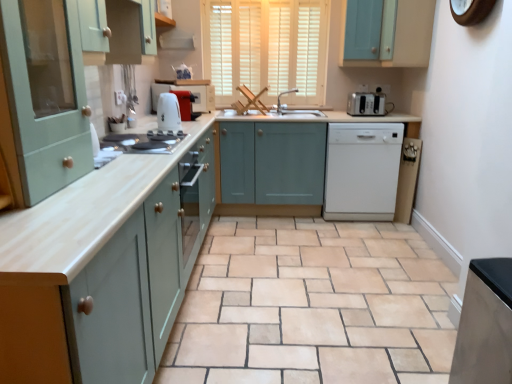
Question: Looking at their shapes, would you say matte silver faucet at center is wider or thinner than white matte dishwasher at center, which is the 3th home appliance from back to front?

Choices:
 (A) wide
 (B) thin

Answer: (B)

Question: Based on their positions, is matte silver faucet at center located to the left or right of white matte dishwasher at center, the second home appliance when ordered from right to left?

Choices:
 (A) right
 (B) left

Answer: (B)

Question: Which object is the farthest from the beige ceramic tile at center?

Choices:
 (A) white glossy exhaust hood at upper center
 (B) white glossy kettle at center
 (C) matte wood countertop at center
 (D) satin silver fridge at lower right, which is counted as the fourth home appliance, starting from the back
 (E) teal wood cabinet at upper right, arranged as the first cabinetry when viewed from the right

Answer: (A)

Question: Estimate the real-world distances between objects in this image. Which object is closer to the matte green cabinet at left, acting as the 2th cabinetry starting from the left?

Choices:
 (A) teal wood cabinet at upper right, the 4th cabinetry positioned from the left
 (B) matte white gas stove at center
 (C) satin silver fridge at lower right, the 1th home appliance when ordered from front to back
 (D) white plastic toaster at right, acting as the 4th home appliance starting from the left
 (E) matte white toaster at center, which ranks as the 2th home appliance in back-to-front order

Answer: (B)